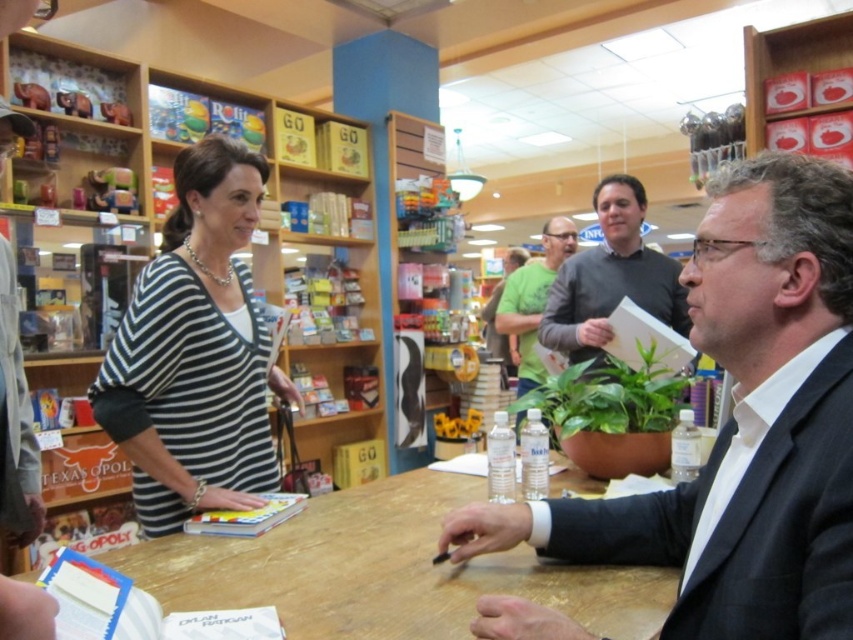
You are a customer in the store and want to reach the wooden shelves at upper left from the wooden table at center. Which direction should you move in?

The wooden shelves at upper left is to the left of wooden table at center, so you should move to the left to reach them.

You are standing in the bookstore and want to move from point A to point B. Point A is at coordinates point (x=271, y=451) and point B is at coordinates point (x=432, y=598). Which point is closer to you?

Point A is closer to you because it is further to the viewer than point B.

You are a tailor who needs to determine which garment to adjust first based on their height. Given that you have the striped knit sweater at center and the green cotton shirt at center in front of you, which one requires more vertical space when hanging?

The striped knit sweater at center requires more vertical space when hanging because it is taller than the green cotton shirt at center.